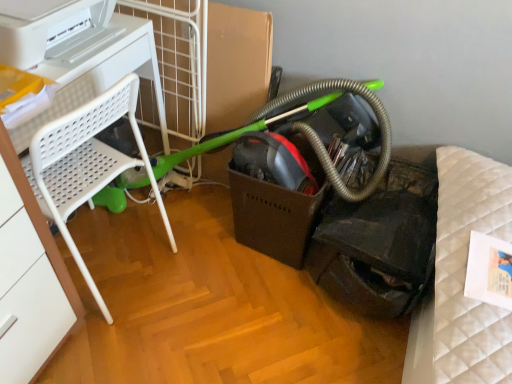
This screenshot has height=384, width=512. Find the location of `vacant area located to the right-hand side of white plastic chair at left`. vacant area located to the right-hand side of white plastic chair at left is located at coordinates pyautogui.click(x=200, y=288).